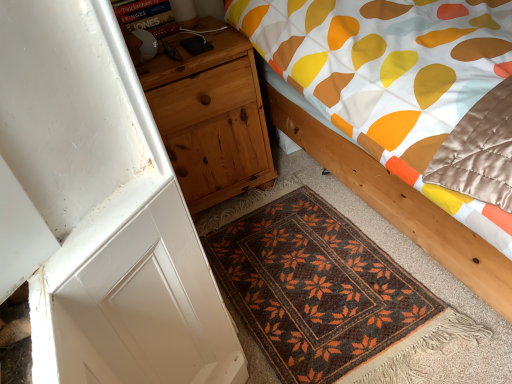
Where is `free spot above natural wood nightstand at left (from a real-world perspective)`? free spot above natural wood nightstand at left (from a real-world perspective) is located at coordinates [195, 52].